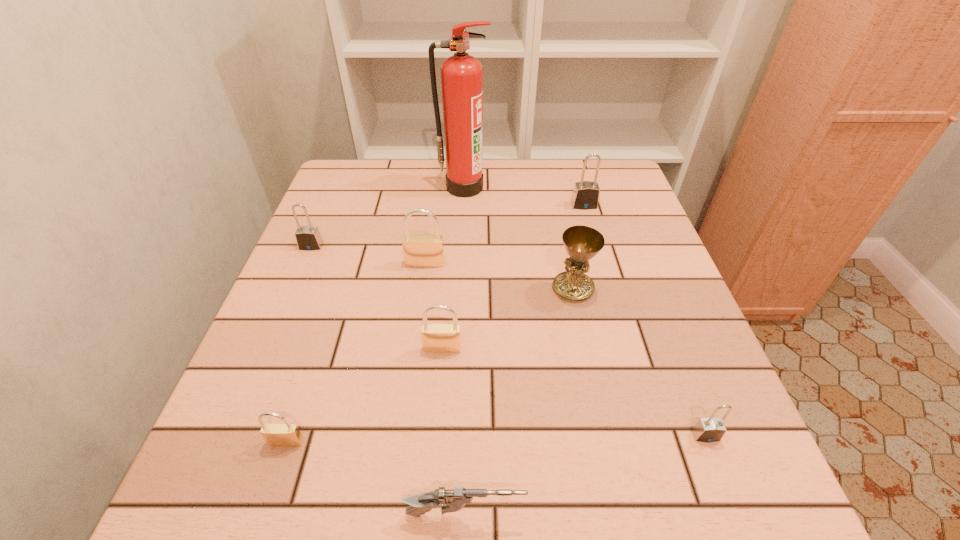
Where is `vacant space that is in between the fifth padlock from left to right and the biggest brass padlock`? This screenshot has width=960, height=540. vacant space that is in between the fifth padlock from left to right and the biggest brass padlock is located at coordinates (505, 234).

Where is `blank region between the eighth object from right to left and the tallest object`? blank region between the eighth object from right to left and the tallest object is located at coordinates (375, 314).

Where is `vacant region between the second farthest gray padlock and the farthest brass padlock`? vacant region between the second farthest gray padlock and the farthest brass padlock is located at coordinates (369, 255).

Locate which object ranks sixth in proximity to the second gray padlock from left to right. Please provide its 2D coordinates. Your answer should be formatted as a tuple, i.e. [(x, y)], where the tuple contains the x and y coordinates of a point satisfying the conditions above.

[(308, 238)]

The height and width of the screenshot is (540, 960). In order to click on object that stands as the third closest to the fifth nearest object in this screenshot , I will do `click(585, 196)`.

The width and height of the screenshot is (960, 540). I want to click on padlock that is the third closest to the fifth nearest padlock, so click(276, 435).

Where is `the third closest padlock to the second smallest gray padlock`? This screenshot has width=960, height=540. the third closest padlock to the second smallest gray padlock is located at coordinates (276, 435).

Identify which gray padlock is located as the nearest to the sixth farthest object. Please provide its 2D coordinates. Your answer should be formatted as a tuple, i.e. [(x, y)], where the tuple contains the x and y coordinates of a point satisfying the conditions above.

[(308, 238)]

Find the location of `gray padlock object that ranks as the closest to the second gray padlock from right to left`. gray padlock object that ranks as the closest to the second gray padlock from right to left is located at coordinates (710, 429).

Select which brass padlock is the closest to the leftmost brass padlock. Please provide its 2D coordinates. Your answer should be formatted as a tuple, i.e. [(x, y)], where the tuple contains the x and y coordinates of a point satisfying the conditions above.

[(437, 338)]